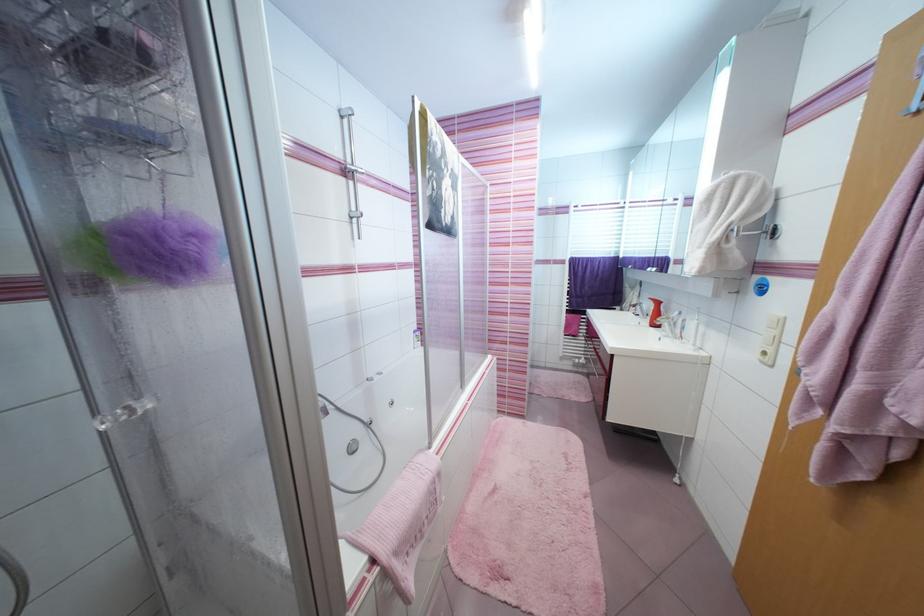
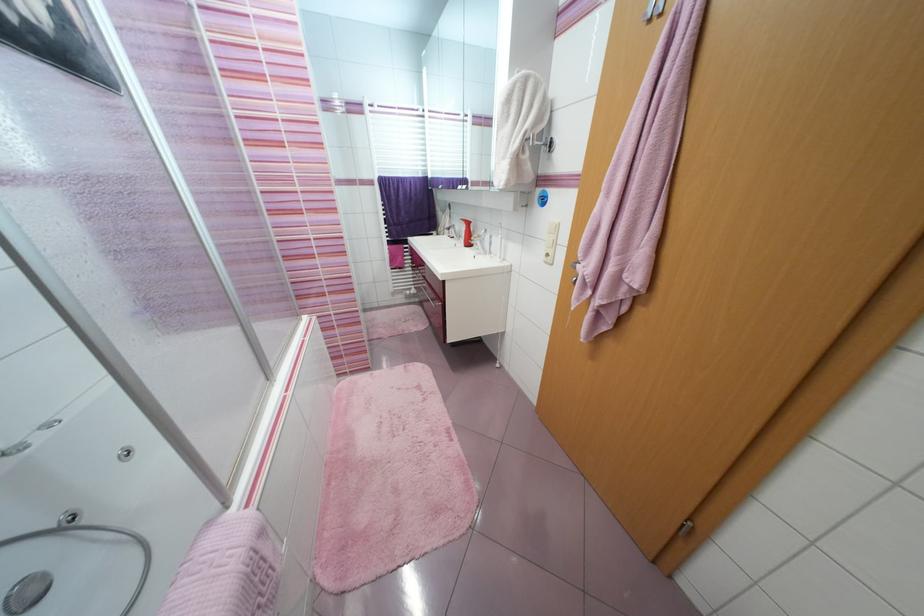
Find the pixel in the second image that matches [671,326] in the first image.

(483, 244)